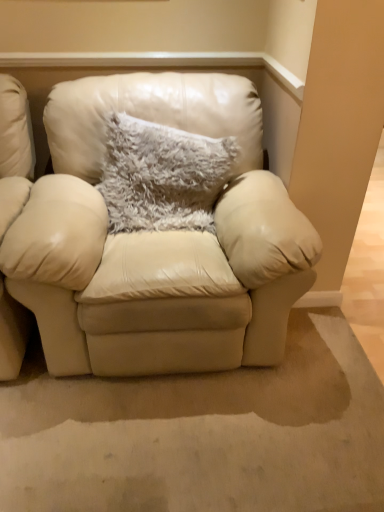
In order to face fuzzy gray pillow at center, should I rotate leftwards or rightwards?

Turn left approximately 3.501 degrees to face it.

This screenshot has width=384, height=512. What are the coordinates of `matte cream leather armchair at center` in the screenshot? It's located at (154, 241).

At what (x,y) coordinates should I click in order to perform the action: click on beige leather chair at left. Please return your answer as a coordinate pair (x, y). The height and width of the screenshot is (512, 384). Looking at the image, I should click on (14, 151).

Considering the relative positions of beige leather chair at left and fuzzy gray pillow at center in the image provided, is beige leather chair at left to the left or to the right of fuzzy gray pillow at center?

Clearly, beige leather chair at left is on the left of fuzzy gray pillow at center in the image.

I want to click on chair that appears on the left of fuzzy gray pillow at center, so click(x=14, y=151).

In terms of height, does beige leather chair at left look taller or shorter compared to fuzzy gray pillow at center?

Clearly, beige leather chair at left is taller compared to fuzzy gray pillow at center.

Based on the photo, from a real-world perspective, between beige leather chair at left and fuzzy gray pillow at center, who is vertically lower?

From a 3D spatial view, beige leather chair at left is below.

Locate an element on the screen. This screenshot has height=512, width=384. chair on the left of matte cream leather armchair at center is located at coordinates (14, 151).

From the image's perspective, is matte cream leather armchair at center located above or below beige leather chair at left?

matte cream leather armchair at center is above beige leather chair at left.

Which object is thinner, matte cream leather armchair at center or beige leather chair at left?

matte cream leather armchair at center.

Considering the sizes of matte cream leather armchair at center and beige leather chair at left in the image, is matte cream leather armchair at center taller or shorter than beige leather chair at left?

matte cream leather armchair at center is taller than beige leather chair at left.

Is matte cream leather armchair at center completely or partially inside fuzzy gray pillow at center?

Actually, matte cream leather armchair at center is outside fuzzy gray pillow at center.

Between fuzzy gray pillow at center and matte cream leather armchair at center, which one is positioned behind?

fuzzy gray pillow at center is further away from the camera.

Which object is wider, fuzzy gray pillow at center or matte cream leather armchair at center?

With larger width is matte cream leather armchair at center.

From a real-world perspective, is matte cream leather armchair at center physically located above or below fuzzy gray pillow at center?

matte cream leather armchair at center is below fuzzy gray pillow at center.

Does point (118, 89) lie in front of point (125, 127)?

No, it is behind (125, 127).

Relative to fuzzy gray pillow at center, is matte cream leather armchair at center in front or behind?

matte cream leather armchair at center is in front of fuzzy gray pillow at center.

What's the angular difference between matte cream leather armchair at center and fuzzy gray pillow at center's facing directions?

10.6 degrees.

Is fuzzy gray pillow at center taller than beige leather chair at left?

No, fuzzy gray pillow at center is not taller than beige leather chair at left.

Does fuzzy gray pillow at center come behind beige leather chair at left?

Yes, it is behind beige leather chair at left.

Does fuzzy gray pillow at center contain beige leather chair at left?

No, beige leather chair at left is not inside fuzzy gray pillow at center.

From the picture: Can you confirm if beige leather chair at left is bigger than matte cream leather armchair at center?

No, beige leather chair at left is not bigger than matte cream leather armchair at center.

From a real-world perspective, is beige leather chair at left positioned under matte cream leather armchair at center based on gravity?

Actually, beige leather chair at left is physically above matte cream leather armchair at center in the real world.

Does beige leather chair at left turn towards matte cream leather armchair at center?

No, beige leather chair at left is not aimed at matte cream leather armchair at center.

How different are the orientations of beige leather chair at left and matte cream leather armchair at center in degrees?

They differ by 0.00013 degrees in their facing directions.

Find the location of `chair below the fuzzy gray pillow at center (from the image's perspective)`. chair below the fuzzy gray pillow at center (from the image's perspective) is located at coordinates (14, 151).

Image resolution: width=384 pixels, height=512 pixels. In order to click on studio couch that appears above the beige leather chair at left (from the image's perspective) in this screenshot , I will do `click(154, 241)`.

From the image, which object appears to be farther from matte cream leather armchair at center, beige leather chair at left or fuzzy gray pillow at center?

beige leather chair at left is positioned further to the anchor matte cream leather armchair at center.

Based on their spatial positions, is matte cream leather armchair at center or beige leather chair at left closer to fuzzy gray pillow at center?

matte cream leather armchair at center is closer to fuzzy gray pillow at center.

Looking at this image, estimate the real-world distances between objects in this image. Which object is closer to beige leather chair at left, matte cream leather armchair at center or fuzzy gray pillow at center?

matte cream leather armchair at center is closer to beige leather chair at left.

In the scene shown: Looking at the image, which one is located further to beige leather chair at left, fuzzy gray pillow at center or matte cream leather armchair at center?

Among the two, fuzzy gray pillow at center is located further to beige leather chair at left.

When comparing their distances from fuzzy gray pillow at center, does beige leather chair at left or matte cream leather armchair at center seem closer?

matte cream leather armchair at center.

Based on the photo, based on their spatial positions, is fuzzy gray pillow at center or beige leather chair at left closer to matte cream leather armchair at center?

Based on the image, fuzzy gray pillow at center appears to be nearer to matte cream leather armchair at center.

Where is `studio couch between beige leather chair at left and fuzzy gray pillow at center from left to right`? The width and height of the screenshot is (384, 512). studio couch between beige leather chair at left and fuzzy gray pillow at center from left to right is located at coordinates (154, 241).